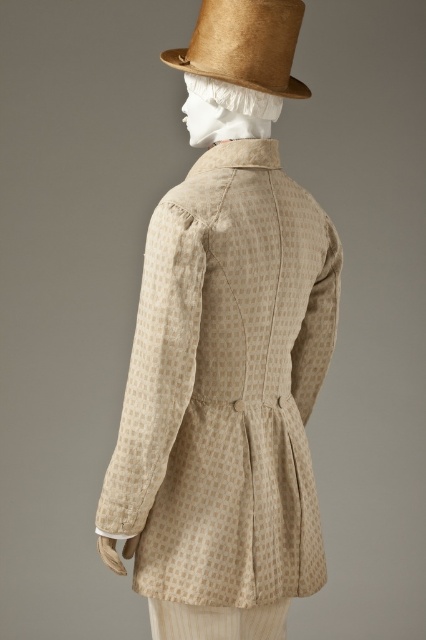
Question: Which of the following is the closest to the observer?

Choices:
 (A) (250, 35)
 (B) (255, 381)

Answer: (A)

Question: Among these points, which one is nearest to the camera?

Choices:
 (A) (287, 90)
 (B) (204, 468)

Answer: (B)

Question: Is beige textured jacket at center further to camera compared to brown straw hat at upper center?

Choices:
 (A) no
 (B) yes

Answer: (A)

Question: Does beige textured jacket at center appear under brown straw hat at upper center?

Choices:
 (A) yes
 (B) no

Answer: (A)

Question: Does beige textured jacket at center have a larger size compared to brown straw hat at upper center?

Choices:
 (A) yes
 (B) no

Answer: (A)

Question: Which point appears closest to the camera in this image?

Choices:
 (A) (173, 522)
 (B) (247, 36)

Answer: (B)